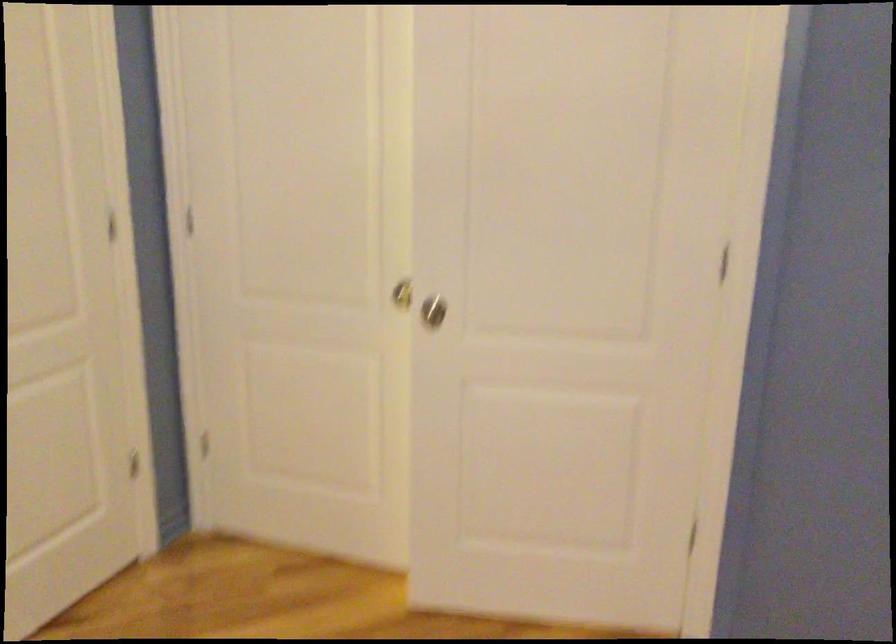
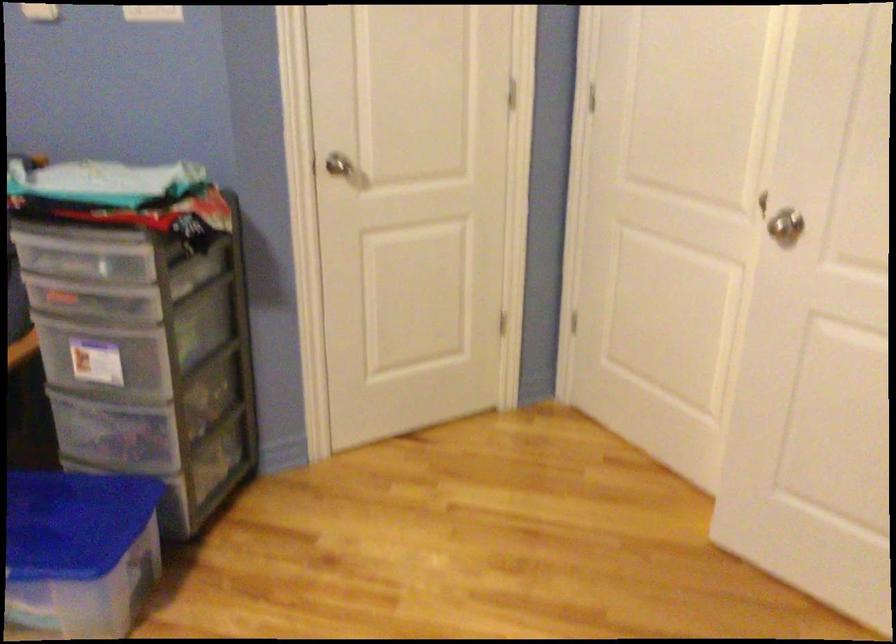
Question: The images are taken continuously from a first-person perspective. In which direction is your viewpoint rotating?

Choices:
 (A) Left
 (B) Right
 (C) Up
 (D) Down

Answer: (A)